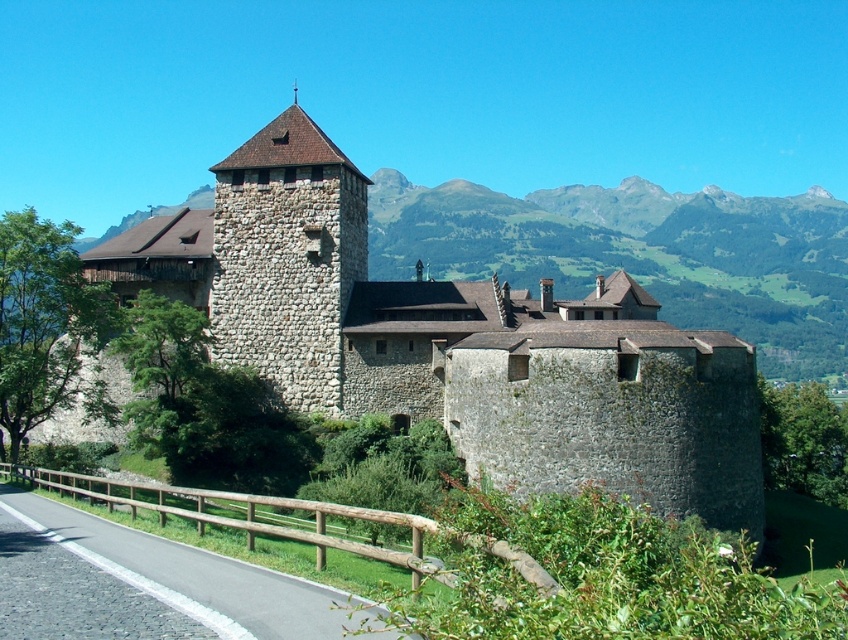
Question: Which point is farther to the camera?

Choices:
 (A) (328, 316)
 (B) (282, 205)

Answer: (B)

Question: Is stone wall at center wider than stone tower at center?

Choices:
 (A) no
 (B) yes

Answer: (B)

Question: Is stone wall at center bigger than stone tower at center?

Choices:
 (A) yes
 (B) no

Answer: (B)

Question: In this image, where is stone wall at center located relative to stone tower at center?

Choices:
 (A) below
 (B) above

Answer: (A)